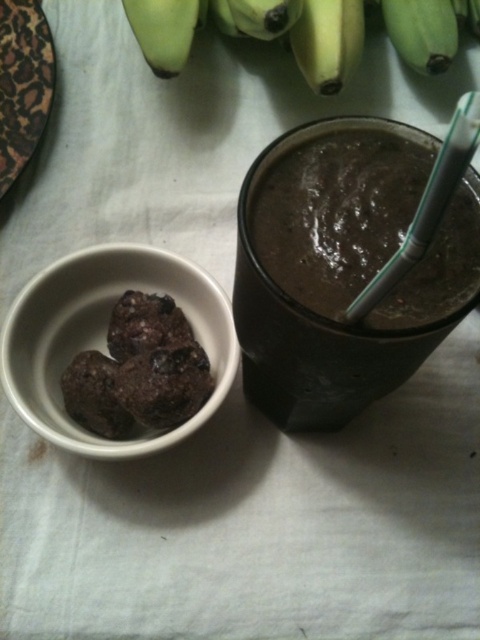
Question: Which point appears closest to the camera in this image?

Choices:
 (A) (100, 346)
 (B) (157, 49)
 (C) (347, 67)

Answer: (A)

Question: Observing the image, what is the correct spatial positioning of white matte bowl at lower left in reference to green matte banana at upper left?

Choices:
 (A) right
 (B) left

Answer: (B)

Question: Among these objects, which one is farthest from the camera?

Choices:
 (A) smooth dark chocolate pudding at center
 (B) white matte bowl at lower left

Answer: (B)

Question: Based on their relative distances, which object is nearer to the green matte banana at upper left?

Choices:
 (A) smooth dark chocolate pudding at center
 (B) white matte bowl at lower left
 (C) green matte bananas at upper center

Answer: (C)

Question: Is white matte bowl at lower left positioned behind green matte bananas at upper center?

Choices:
 (A) yes
 (B) no

Answer: (B)

Question: Can you confirm if smooth dark chocolate pudding at center is positioned above green matte bananas at upper center?

Choices:
 (A) yes
 (B) no

Answer: (B)